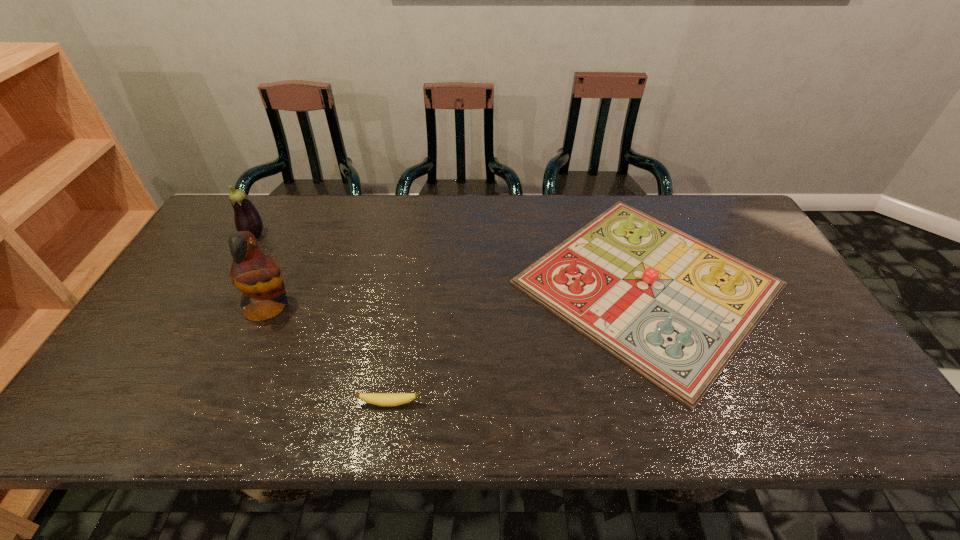
Locate an element on the screen. free spot between the banana and the eggplant is located at coordinates [322, 319].

In order to click on vacant space that is in between the second object from right to left and the rightmost object in this screenshot , I will do `click(518, 343)`.

At what (x,y) coordinates should I click in order to perform the action: click on unoccupied area between the second object from right to left and the third shortest object. Please return your answer as a coordinate pair (x, y). Looking at the image, I should click on (322, 319).

Identify the location of vacant space in between the shortest object and the second object from left to right. point(329,355).

Choose which object is the nearest neighbor to the second object from left to right. Please provide its 2D coordinates. Your answer should be formatted as a tuple, i.e. [(x, y)], where the tuple contains the x and y coordinates of a point satisfying the conditions above.

[(246, 216)]

Locate an element on the screen. object that is the second closest one to the second object from left to right is located at coordinates (381, 399).

Identify the location of vacant area in the image that satisfies the following two spatial constraints: 1. on the face of the shortest object; 2. on the right side of the tallest object. The width and height of the screenshot is (960, 540). (226, 403).

This screenshot has height=540, width=960. I want to click on vacant position in the image that satisfies the following two spatial constraints: 1. on the face of the parrot; 2. on the left side of the shortest object, so click(226, 403).

What are the coordinates of `free location that satisfies the following two spatial constraints: 1. on the front side of the rightmost object; 2. on the face of the parrot` in the screenshot? It's located at (657, 307).

Where is `vacant region that satisfies the following two spatial constraints: 1. on the face of the third object from right to left; 2. on the right side of the shortest object`? The image size is (960, 540). vacant region that satisfies the following two spatial constraints: 1. on the face of the third object from right to left; 2. on the right side of the shortest object is located at coordinates (226, 403).